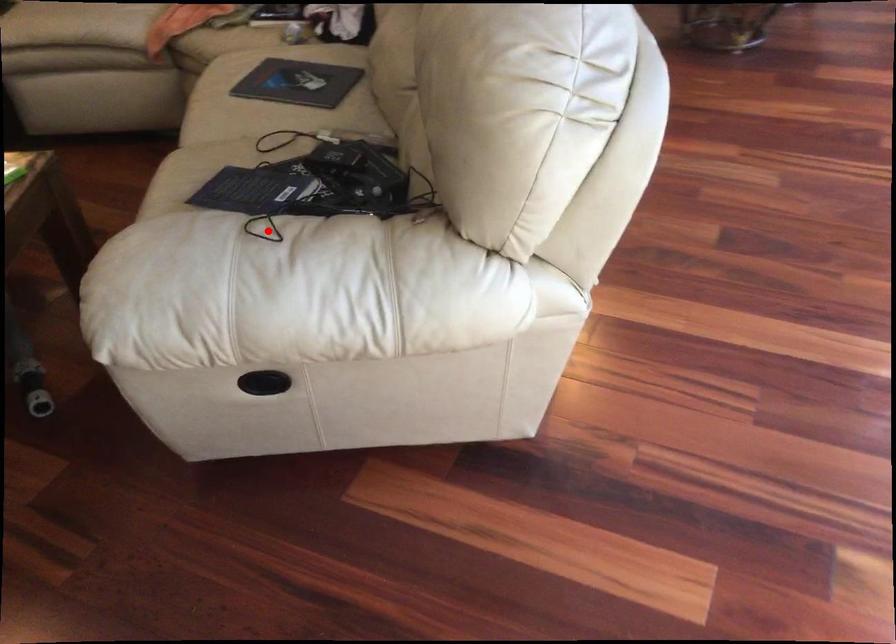
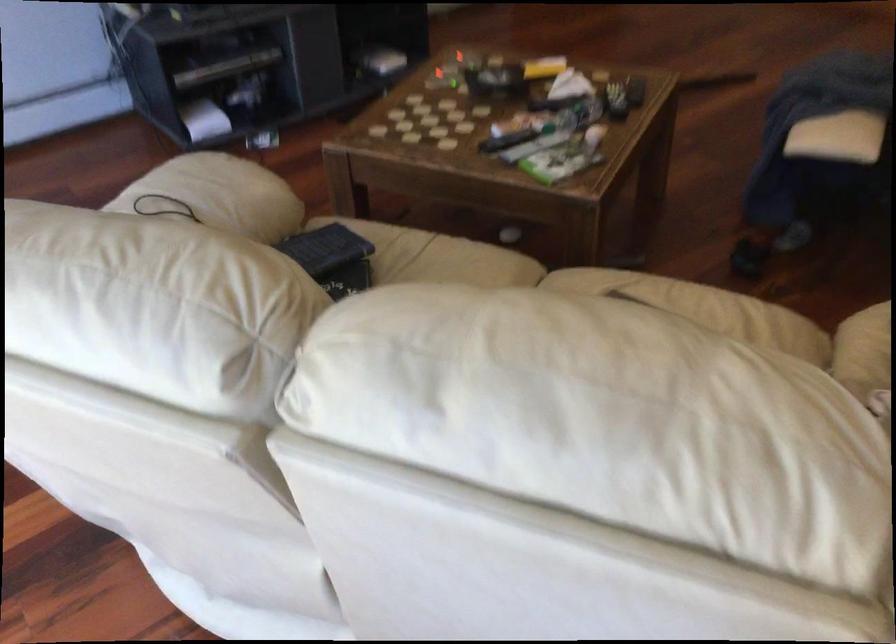
Where in the second image is the point corresponding to the highlighted location from the first image?

(162, 205)